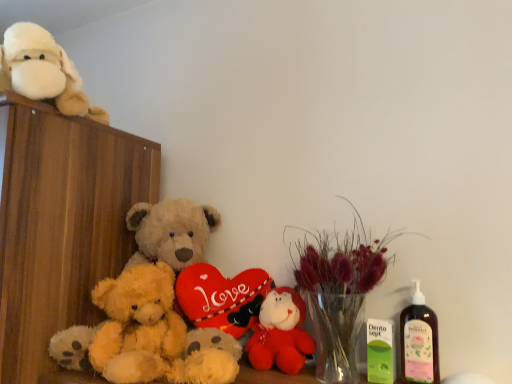
Question: Considering the relative sizes of translucent glass vase at center and fluffy beige teddy bear at center, positioned as the second teddy bear in bottom-to-top order, in the image provided, is translucent glass vase at center bigger than fluffy beige teddy bear at center, positioned as the second teddy bear in bottom-to-top order,?

Choices:
 (A) yes
 (B) no

Answer: (B)

Question: Considering the relative sizes of translucent glass vase at center and fluffy beige teddy bear at center, positioned as the second teddy bear in bottom-to-top order, in the image provided, is translucent glass vase at center thinner than fluffy beige teddy bear at center, positioned as the second teddy bear in bottom-to-top order,?

Choices:
 (A) yes
 (B) no

Answer: (A)

Question: Considering the relative sizes of translucent glass vase at center and fluffy beige teddy bear at center, which appears as the 2th teddy bear when viewed from the top, in the image provided, is translucent glass vase at center shorter than fluffy beige teddy bear at center, which appears as the 2th teddy bear when viewed from the top,?

Choices:
 (A) yes
 (B) no

Answer: (A)

Question: Does translucent glass vase at center appear on the right side of fluffy beige teddy bear at center, which appears as the 2th teddy bear when viewed from the top?

Choices:
 (A) no
 (B) yes

Answer: (B)

Question: From the image's perspective, does translucent glass vase at center appear lower than fluffy beige teddy bear at center, which appears as the 2th teddy bear when viewed from the top?

Choices:
 (A) yes
 (B) no

Answer: (A)

Question: Considering the relative positions of translucent glass vase at center and fluffy beige teddy bear at center, positioned as the second teddy bear in bottom-to-top order, in the image provided, is translucent glass vase at center behind fluffy beige teddy bear at center, positioned as the second teddy bear in bottom-to-top order,?

Choices:
 (A) yes
 (B) no

Answer: (B)

Question: Is fluffy yellow teddy bear at center, the 1th teddy bear positioned from the bottom, further to the viewer compared to velvet red plush toy at center?

Choices:
 (A) yes
 (B) no

Answer: (B)

Question: Considering the relative sizes of fluffy yellow teddy bear at center, which is the 3th teddy bear in top-to-bottom order, and velvet red plush toy at center in the image provided, is fluffy yellow teddy bear at center, which is the 3th teddy bear in top-to-bottom order, bigger than velvet red plush toy at center?

Choices:
 (A) yes
 (B) no

Answer: (A)

Question: Is fluffy yellow teddy bear at center, which is the 3th teddy bear in top-to-bottom order, oriented towards velvet red plush toy at center?

Choices:
 (A) yes
 (B) no

Answer: (B)

Question: Considering the relative positions of fluffy yellow teddy bear at center, the 1th teddy bear positioned from the bottom, and velvet red plush toy at center in the image provided, is fluffy yellow teddy bear at center, the 1th teddy bear positioned from the bottom, in front of velvet red plush toy at center?

Choices:
 (A) yes
 (B) no

Answer: (A)

Question: Is fluffy yellow teddy bear at center, which is the 3th teddy bear in top-to-bottom order, smaller than velvet red plush toy at center?

Choices:
 (A) no
 (B) yes

Answer: (A)

Question: From the image's perspective, is fluffy yellow teddy bear at center, which is the 3th teddy bear in top-to-bottom order, beneath velvet red plush toy at center?

Choices:
 (A) no
 (B) yes

Answer: (A)

Question: Is there a large distance between wooden cabinet at left and fluffy yellow teddy bear at center, the 1th teddy bear positioned from the bottom?

Choices:
 (A) no
 (B) yes

Answer: (A)